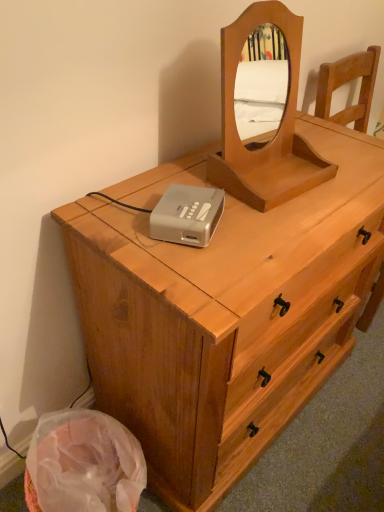
The height and width of the screenshot is (512, 384). I want to click on free spot in front of silver plastic cassette at center, so click(193, 275).